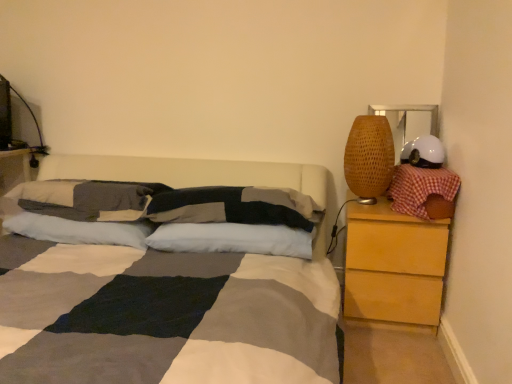
Where is `free space above red checkered pillow at right, the 1th pillow in the right-to-left sequence (from a real-world perspective)`? free space above red checkered pillow at right, the 1th pillow in the right-to-left sequence (from a real-world perspective) is located at coordinates (424, 167).